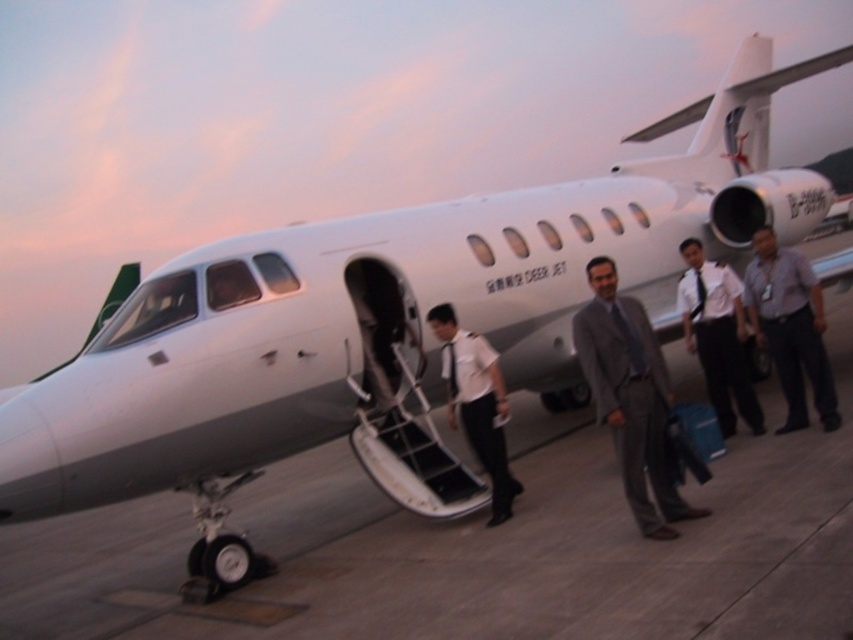
Is gray uniformed man at center positioned before white shirt at center?

That is True.

Does gray uniformed man at center have a smaller size compared to white shirt at center?

Yes.

Consider the image. Measure the distance between point (764, 316) and camera.

A distance of 18.99 feet exists between point (764, 316) and camera.

The height and width of the screenshot is (640, 853). I want to click on gray uniformed man at center, so click(790, 326).

Is gray suit at center bigger than white uniform at center?

Actually, gray suit at center might be smaller than white uniform at center.

Locate an element on the screen. Image resolution: width=853 pixels, height=640 pixels. gray suit at center is located at coordinates (630, 396).

Who is more forward, (x=590, y=275) or (x=480, y=460)?

Positioned in front is point (x=590, y=275).

Identify the location of gray suit at center. The image size is (853, 640). click(630, 396).

In the scene shown: Is gray suit at center above white shirt at center?

Incorrect, gray suit at center is not positioned above white shirt at center.

Locate an element on the screen. gray suit at center is located at coordinates (630, 396).